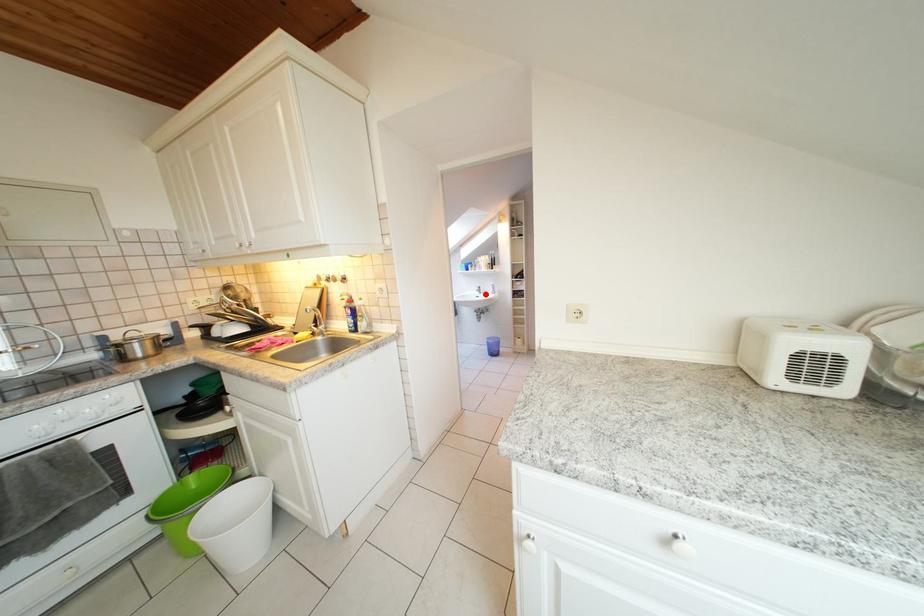
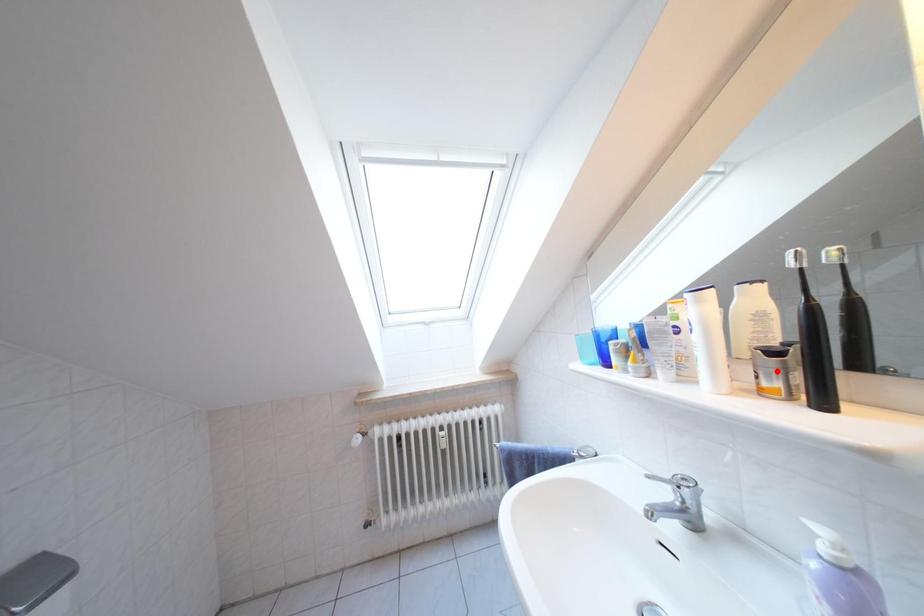
I am providing you with two images of the same scene from different viewpoints. A red point is marked on the first image and another point is marked on the second image. Are the points marked in image1 and image2 representing the same 3D position?

No